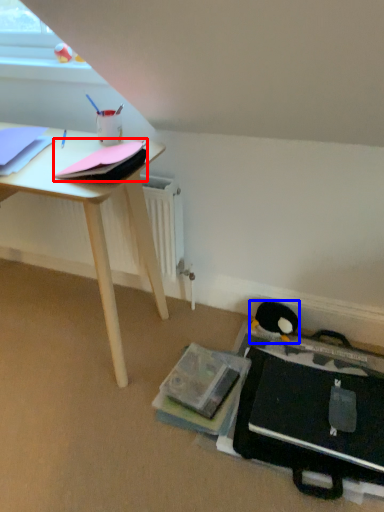
Question: Which point is further to the camera, paperback book (highlighted by a red box) or penguin (highlighted by a blue box)?

Choices:
 (A) paperback book
 (B) penguin

Answer: (B)